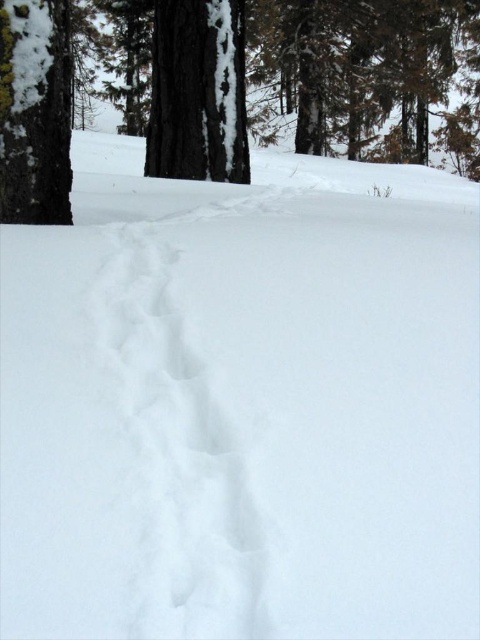
Question: Can you confirm if white fluffy snow trail at center is positioned to the right of smooth bark tree at center?

Choices:
 (A) no
 (B) yes

Answer: (B)

Question: Based on their relative distances, which object is nearer to the white fluffy snow trail at center?

Choices:
 (A) brown rough tree at center
 (B) smooth bark tree at center

Answer: (B)

Question: Which of the following is the closest to the observer?

Choices:
 (A) (259, 138)
 (B) (224, 589)
 (C) (188, 125)

Answer: (B)

Question: Which object is closer to the camera taking this photo?

Choices:
 (A) smooth bark tree at center
 (B) white fluffy snow trail at center

Answer: (B)

Question: Is white fluffy snow trail at center closer to camera compared to smooth bark tree at center?

Choices:
 (A) yes
 (B) no

Answer: (A)

Question: Is brown rough tree at center wider than white fluffy snow trail at center?

Choices:
 (A) yes
 (B) no

Answer: (A)